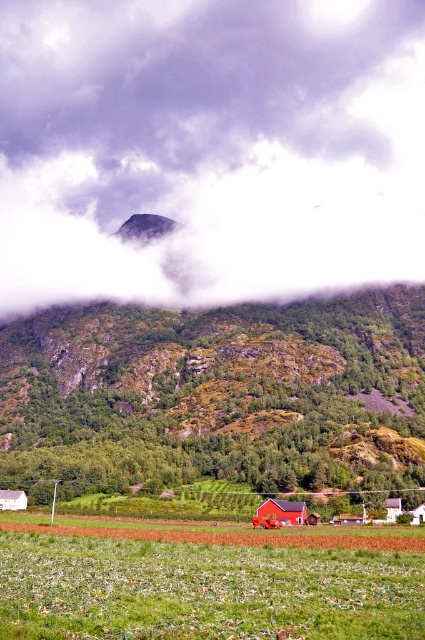
Who is positioned more to the right, white fluffy cloud at upper center or matte red barn at center?

From the viewer's perspective, matte red barn at center appears more on the right side.

The height and width of the screenshot is (640, 425). Describe the element at coordinates (209, 147) in the screenshot. I see `white fluffy cloud at upper center` at that location.

The width and height of the screenshot is (425, 640). What are the coordinates of `white fluffy cloud at upper center` in the screenshot? It's located at (209, 147).

Between green grass at lower center and matte red barn at center, which one is positioned lower?

matte red barn at center is lower down.

Is point (286, 595) farther from viewer compared to point (294, 506)?

No, (286, 595) is closer to viewer.

Locate an element on the screen. The image size is (425, 640). green grass at lower center is located at coordinates (204, 589).

Can you confirm if white fluffy cloud at upper center is smaller than green grass at lower center?

Actually, white fluffy cloud at upper center might be larger than green grass at lower center.

Which is more to the right, white fluffy cloud at upper center or green grass at lower center?

Positioned to the right is green grass at lower center.

Is point (387, 120) positioned in front of point (144, 577)?

No, it is not.

Image resolution: width=425 pixels, height=640 pixels. Find the location of `white fluffy cloud at upper center`. white fluffy cloud at upper center is located at coordinates (209, 147).